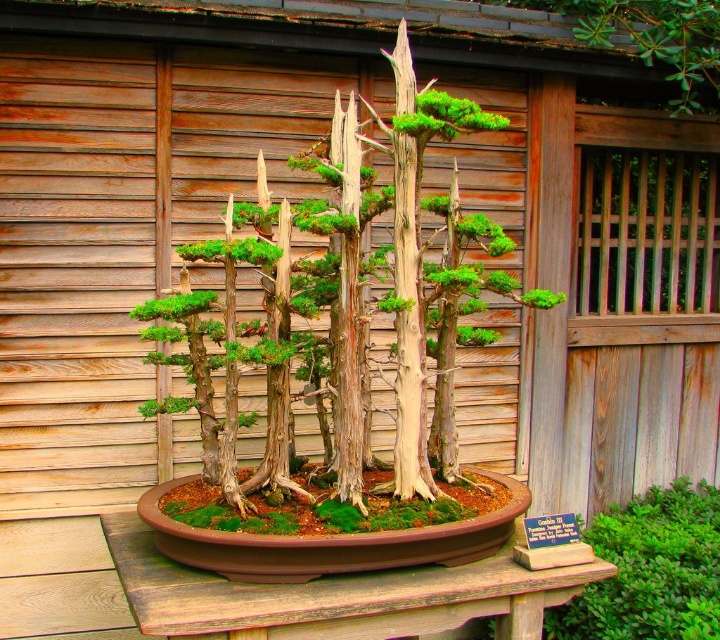
Question: Is green textured bonsai at center behind brown wooden table at center?

Choices:
 (A) yes
 (B) no

Answer: (A)

Question: Does green textured bonsai at center have a larger size compared to brown wooden table at center?

Choices:
 (A) no
 (B) yes

Answer: (B)

Question: From the image, what is the correct spatial relationship of green textured bonsai at center in relation to brown wooden table at center?

Choices:
 (A) below
 (B) above

Answer: (B)